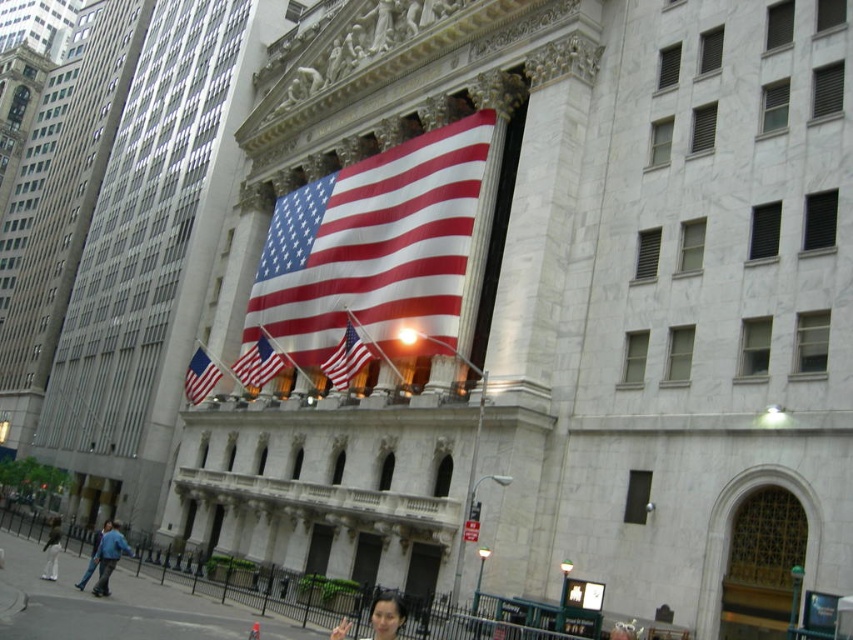
Question: Is matte fabric flag at center bigger than white cotton pants at lower left?

Choices:
 (A) no
 (B) yes

Answer: (A)

Question: Can you confirm if textured fabric flag at center is positioned to the left of white cotton pants at lower left?

Choices:
 (A) yes
 (B) no

Answer: (B)

Question: Does matte fabric flag at center come behind blue denim jacket at lower left?

Choices:
 (A) yes
 (B) no

Answer: (A)

Question: Among these objects, which one is farthest from the camera?

Choices:
 (A) blue denim jacket at lower left
 (B) blue jeans at lower left
 (C) red-white-striped fabric flag at center

Answer: (C)

Question: Which point is farther to the camera?

Choices:
 (A) (199, 401)
 (B) (74, 586)
 (C) (99, 544)
 (D) (253, 380)

Answer: (A)

Question: Which object is closer to the camera taking this photo?

Choices:
 (A) textured fabric flag at center
 (B) blue denim jacket at lower left
 (C) smooth skin face at lower center

Answer: (C)